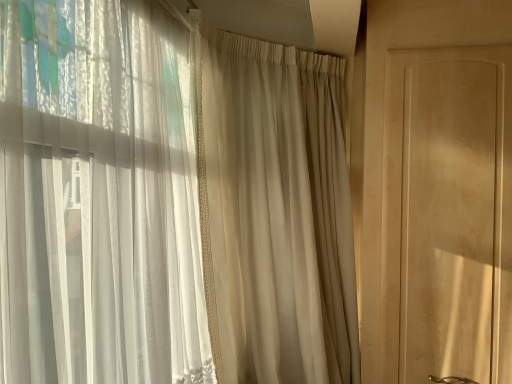
Image resolution: width=512 pixels, height=384 pixels. Describe the element at coordinates (448, 220) in the screenshot. I see `matte wood screen door at right` at that location.

Identify the location of matte wood screen door at right. (448, 220).

Measure the distance between point (x=474, y=215) and camera.

The distance of point (x=474, y=215) from camera is 5.33 feet.

The width and height of the screenshot is (512, 384). Describe the element at coordinates (279, 212) in the screenshot. I see `beige sheer curtain at center` at that location.

Locate an element on the screen. This screenshot has width=512, height=384. beige sheer curtain at center is located at coordinates (279, 212).

You are a GUI agent. You are given a task and a screenshot of the screen. Output one action in this format:
    pyautogui.click(x=<x>, y=<y>)
    Task: Click on the matte wood screen door at right
    
    Given the screenshot: What is the action you would take?
    coord(448,220)

Based on their positions, is beige sheer curtain at center located to the left or right of matte wood screen door at right?

Based on their positions, beige sheer curtain at center is located to the left of matte wood screen door at right.

From the picture: Is the depth of beige sheer curtain at center less than that of matte wood screen door at right?

Yes, it is in front of matte wood screen door at right.

Considering the positions of points (223, 289) and (429, 354), is point (223, 289) farther from camera compared to point (429, 354)?

No.

From the image's perspective, between beige sheer curtain at center and matte wood screen door at right, which one is located above?

matte wood screen door at right.

From a real-world perspective, is beige sheer curtain at center positioned under matte wood screen door at right based on gravity?

Yes, from a real-world perspective, beige sheer curtain at center is below matte wood screen door at right.

Looking at their sizes, would you say beige sheer curtain at center is wider or thinner than matte wood screen door at right?

Clearly, beige sheer curtain at center has more width compared to matte wood screen door at right.

Is beige sheer curtain at center shorter than matte wood screen door at right?

No, beige sheer curtain at center is not shorter than matte wood screen door at right.

Does beige sheer curtain at center have a smaller size compared to matte wood screen door at right?

Actually, beige sheer curtain at center might be larger than matte wood screen door at right.

Which is correct: beige sheer curtain at center is inside matte wood screen door at right, or outside of it?

beige sheer curtain at center is not inside matte wood screen door at right, it's outside.

Are beige sheer curtain at center and matte wood screen door at right beside each other?

No, beige sheer curtain at center is not touching matte wood screen door at right.

Is beige sheer curtain at center oriented towards matte wood screen door at right?

No, beige sheer curtain at center is not aimed at matte wood screen door at right.

How different are the orientations of beige sheer curtain at center and matte wood screen door at right in degrees?

45.7 degrees separate the facing orientations of beige sheer curtain at center and matte wood screen door at right.

Measure the distance between beige sheer curtain at center and matte wood screen door at right.

They are 18.75 inches apart.

In the image, there is a matte wood screen door at right. Where is `curtain below it (from a real-world perspective)`? Image resolution: width=512 pixels, height=384 pixels. curtain below it (from a real-world perspective) is located at coordinates (279, 212).

Considering the relative positions of matte wood screen door at right and beige sheer curtain at center in the image provided, is matte wood screen door at right to the right of beige sheer curtain at center from the viewer's perspective?

Yes.

Which is in front, matte wood screen door at right or beige sheer curtain at center?

beige sheer curtain at center is more forward.

Which is closer to the camera, [409,173] or [310,364]?

The point [310,364] is more forward.

From the image's perspective, between matte wood screen door at right and beige sheer curtain at center, who is located below?

From the image's view, beige sheer curtain at center is below.

From a real-world perspective, between matte wood screen door at right and beige sheer curtain at center, who is vertically lower?

beige sheer curtain at center is physically lower.

Between matte wood screen door at right and beige sheer curtain at center, which one has smaller width?

matte wood screen door at right is thinner.

Who is shorter, matte wood screen door at right or beige sheer curtain at center?

matte wood screen door at right is shorter.

Considering the sizes of matte wood screen door at right and beige sheer curtain at center in the image, is matte wood screen door at right bigger or smaller than beige sheer curtain at center?

In the image, matte wood screen door at right appears to be smaller than beige sheer curtain at center.

Do you think matte wood screen door at right is within beige sheer curtain at center, or outside of it?

matte wood screen door at right is outside beige sheer curtain at center.

Is matte wood screen door at right far away from beige sheer curtain at center?

No, there isn't a large distance between matte wood screen door at right and beige sheer curtain at center.

Is matte wood screen door at right positioned with its back to beige sheer curtain at center?

matte wood screen door at right is not turned away from beige sheer curtain at center.

Can you tell me how much matte wood screen door at right and beige sheer curtain at center differ in facing direction?

The facing directions of matte wood screen door at right and beige sheer curtain at center are 45.7 degrees apart.

Locate an element on the screen. The height and width of the screenshot is (384, 512). screen door behind the beige sheer curtain at center is located at coordinates (448, 220).

Find the location of a particular element. The height and width of the screenshot is (384, 512). screen door that appears above the beige sheer curtain at center (from the image's perspective) is located at coordinates (448, 220).

Where is `screen door behind the beige sheer curtain at center`? screen door behind the beige sheer curtain at center is located at coordinates (448, 220).